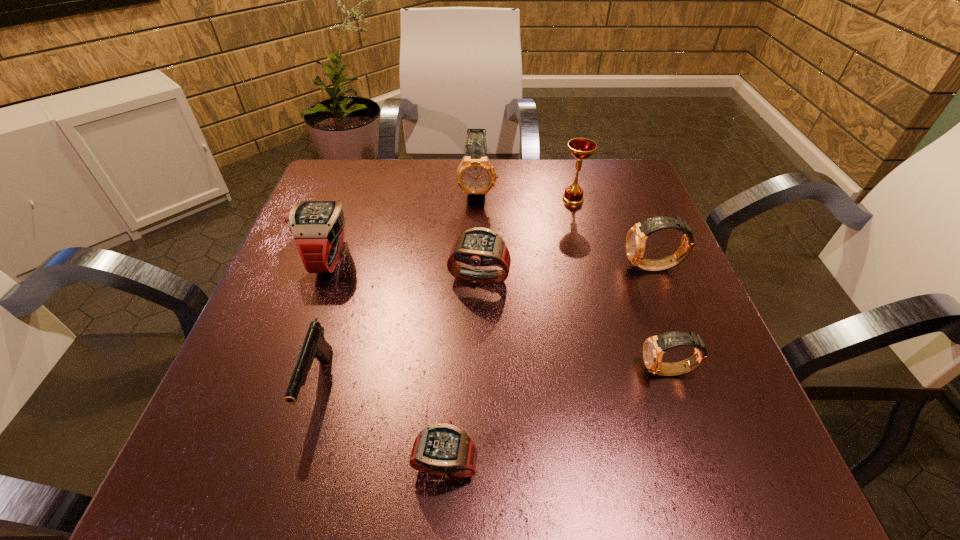
Where is `the farthest gold watch`? the farthest gold watch is located at coordinates (475, 176).

Image resolution: width=960 pixels, height=540 pixels. Identify the location of the leftmost gold watch. (475, 176).

Where is `the third object from right to left`? The height and width of the screenshot is (540, 960). the third object from right to left is located at coordinates (581, 148).

Identify the location of the biggest red watch. (317, 227).

Find the location of a particular element. The height and width of the screenshot is (540, 960). the leftmost watch is located at coordinates (317, 227).

What are the coordinates of `the second biggest gold watch` in the screenshot? It's located at (636, 237).

Image resolution: width=960 pixels, height=540 pixels. What are the coordinates of `the second smallest red watch` in the screenshot? It's located at click(x=479, y=246).

What are the coordinates of `the smallest gold watch` in the screenshot? It's located at (654, 347).

Locate an element on the screen. Image resolution: width=960 pixels, height=540 pixels. the nearest gold watch is located at coordinates (654, 347).

Image resolution: width=960 pixels, height=540 pixels. I want to click on black pistol, so click(315, 346).